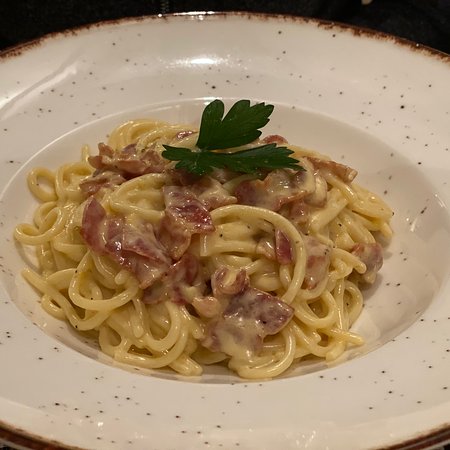
You are a GUI agent. You are given a task and a screenshot of the screen. Output one action in this format:
    pyautogui.click(x=<x>, y=<y>)
    Task: Click on the table
    This screenshot has height=450, width=450.
    Given the screenshot: What is the action you would take?
    pyautogui.click(x=17, y=30), pyautogui.click(x=421, y=17)